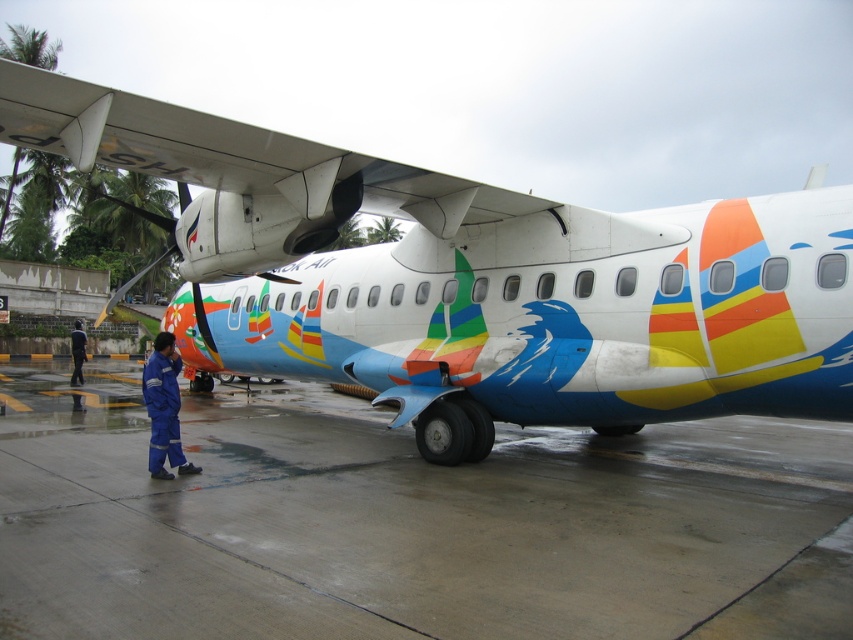
Question: Which object is positioned closest to the wet concrete tarmac at lower center?

Choices:
 (A) blue uniform at lower left
 (B) matte white airplane at center
 (C) blue fabric uniform at center

Answer: (B)

Question: Is blue fabric uniform at center thinner than blue uniform at lower left?

Choices:
 (A) no
 (B) yes

Answer: (B)

Question: Which is farther from the wet concrete tarmac at lower center?

Choices:
 (A) blue uniform at lower left
 (B) blue fabric uniform at center
 (C) matte white airplane at center

Answer: (A)

Question: Which point is farther to the camera?

Choices:
 (A) (155, 364)
 (B) (103, 422)
 (C) (80, 349)
 (D) (349, 252)

Answer: (C)

Question: Does blue fabric uniform at center have a smaller size compared to blue uniform at lower left?

Choices:
 (A) yes
 (B) no

Answer: (A)

Question: In this image, where is blue fabric uniform at center located relative to blue uniform at lower left?

Choices:
 (A) above
 (B) below

Answer: (A)